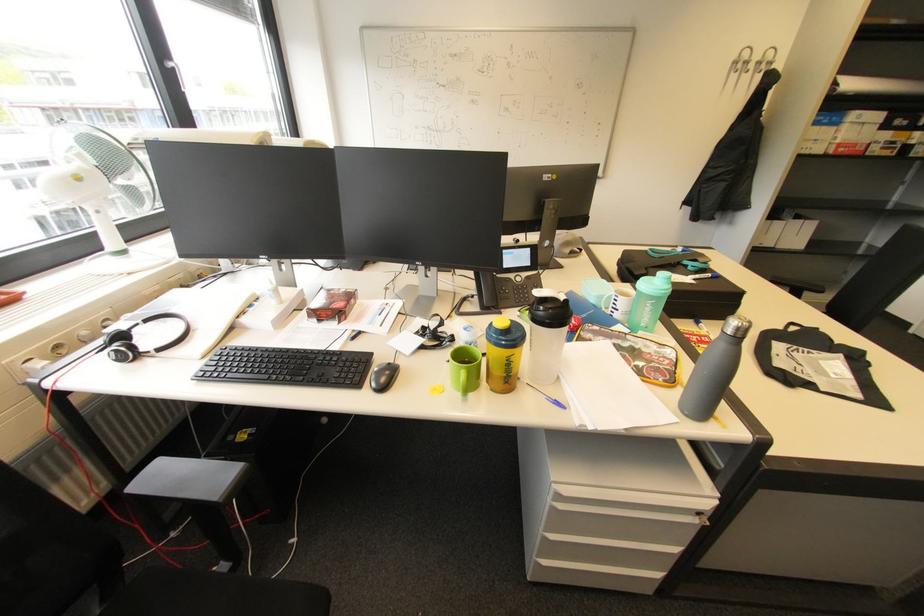
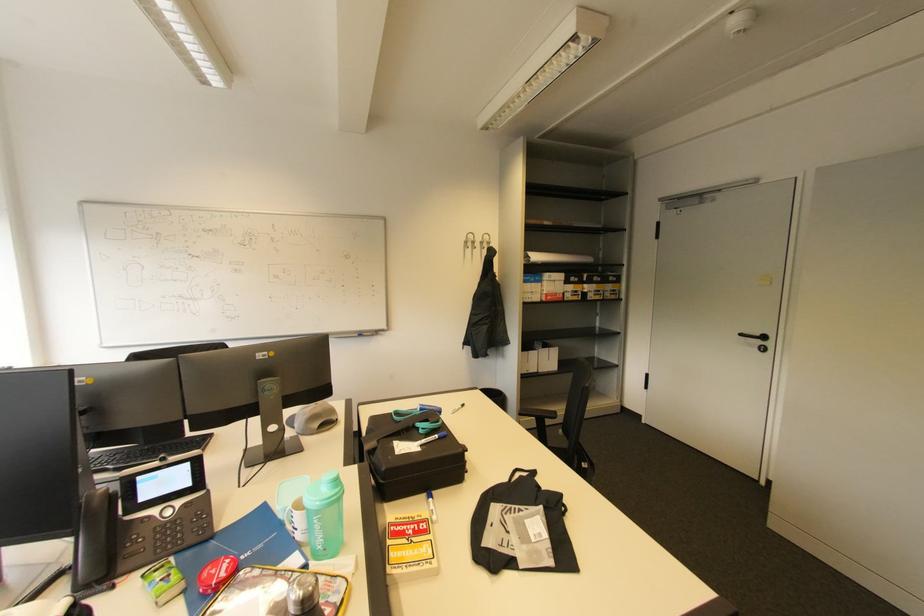
In the second image, find the point that corresponds to (792,211) in the first image.

(541, 342)